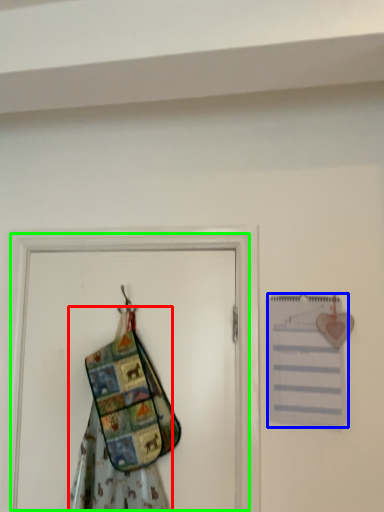
Question: Which object is the farthest from fancy dress (highlighted by a red box)? Choose among these: journal (highlighted by a blue box) or screen door (highlighted by a green box).

Choices:
 (A) journal
 (B) screen door

Answer: (A)